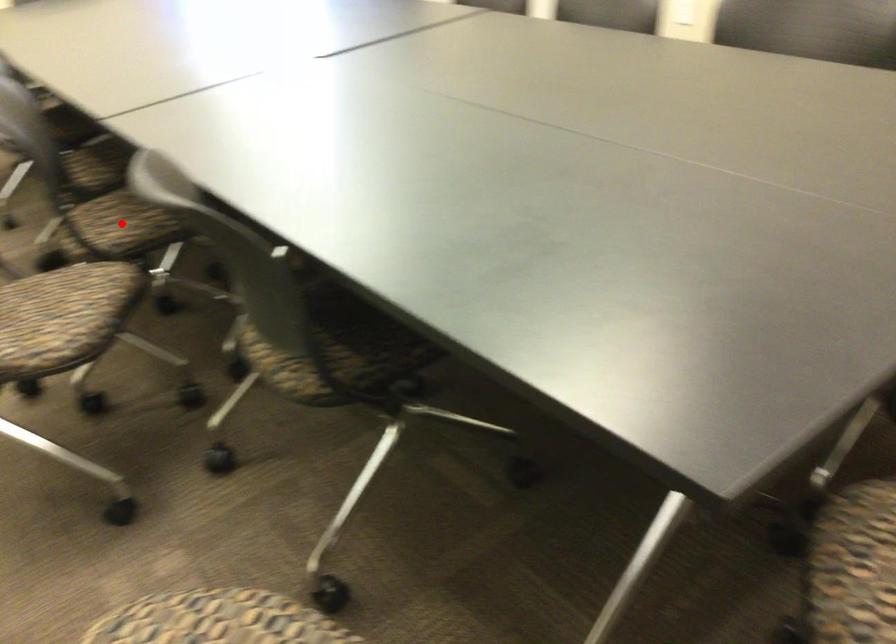
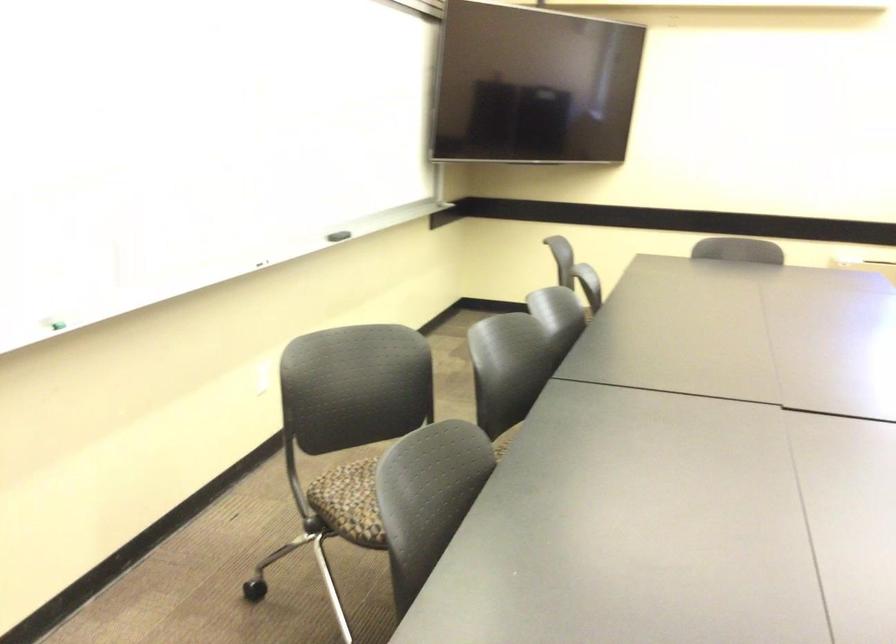
Question: I am providing you with two images of the same scene from different viewpoints. A red point is marked on the first image. At the location where the point appears in image 1, is it still visible in image 2?

Choices:
 (A) Yes
 (B) No

Answer: (B)